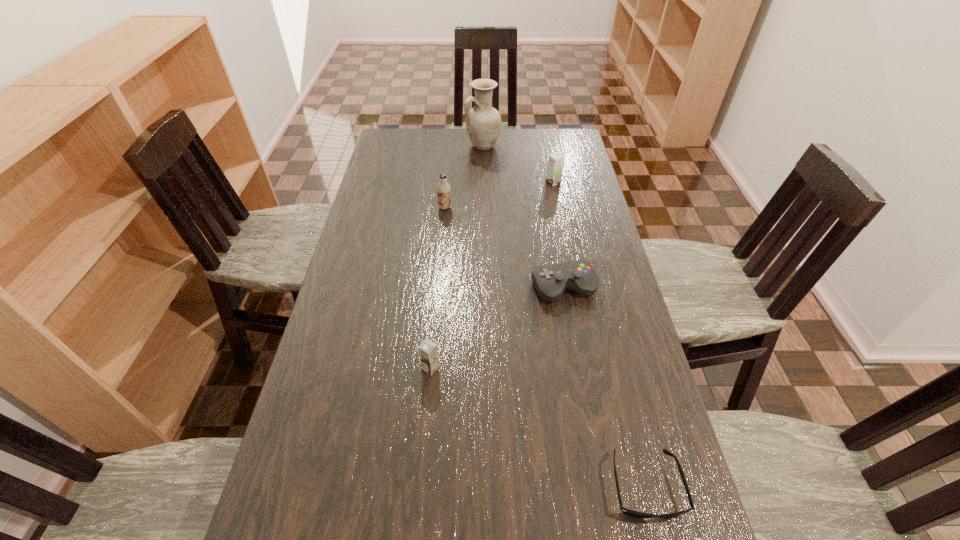
Find the location of `free space between the second farthest chocolate milk and the second shortest object`. free space between the second farthest chocolate milk and the second shortest object is located at coordinates (504, 247).

Where is `free space between the nearest object and the tallest object`? free space between the nearest object and the tallest object is located at coordinates (564, 316).

Identify the location of empty location between the shortest chocolate milk and the second shortest object. The image size is (960, 540). (497, 328).

Identify the location of free space between the second nearest chocolate milk and the farthest chocolate milk. (499, 195).

This screenshot has height=540, width=960. Find the location of `free space between the fifth nearest object and the control`. free space between the fifth nearest object and the control is located at coordinates (559, 235).

Find the location of a particular element. the fifth closest object to the nearest object is located at coordinates [483, 122].

Identify which object is the fifth closest to the tallest object. Please provide its 2D coordinates. Your answer should be formatted as a tuple, i.e. [(x, y)], where the tuple contains the x and y coordinates of a point satisfying the conditions above.

[(625, 511)]

Locate an element on the screen. the closest chocolate milk to the rightmost chocolate milk is located at coordinates coord(443,188).

Choose which chocolate milk is the second nearest neighbor to the control. Please provide its 2D coordinates. Your answer should be formatted as a tuple, i.e. [(x, y)], where the tuple contains the x and y coordinates of a point satisfying the conditions above.

[(443, 188)]

Where is `free region that satisfies the following two spatial constraints: 1. on the back side of the fifth tallest object; 2. on the left side of the fifth farthest object`? The width and height of the screenshot is (960, 540). free region that satisfies the following two spatial constraints: 1. on the back side of the fifth tallest object; 2. on the left side of the fifth farthest object is located at coordinates (438, 288).